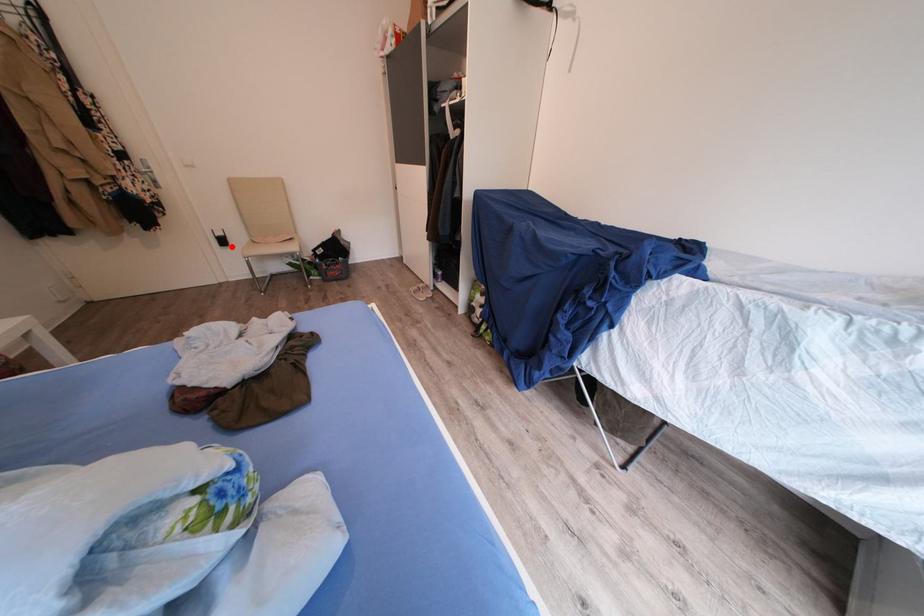
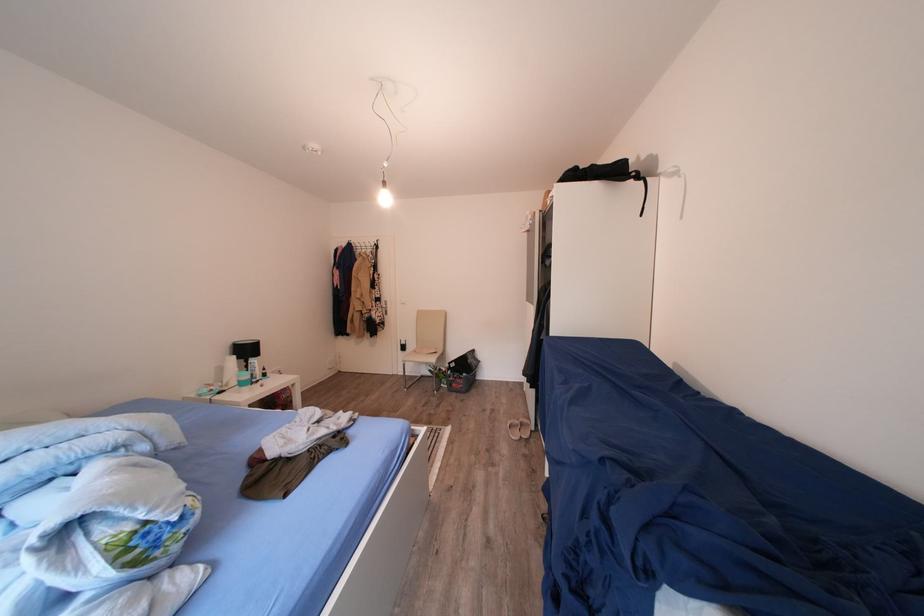
Where in the second image is the point corresponding to the highlighted location from the first image?

(411, 353)